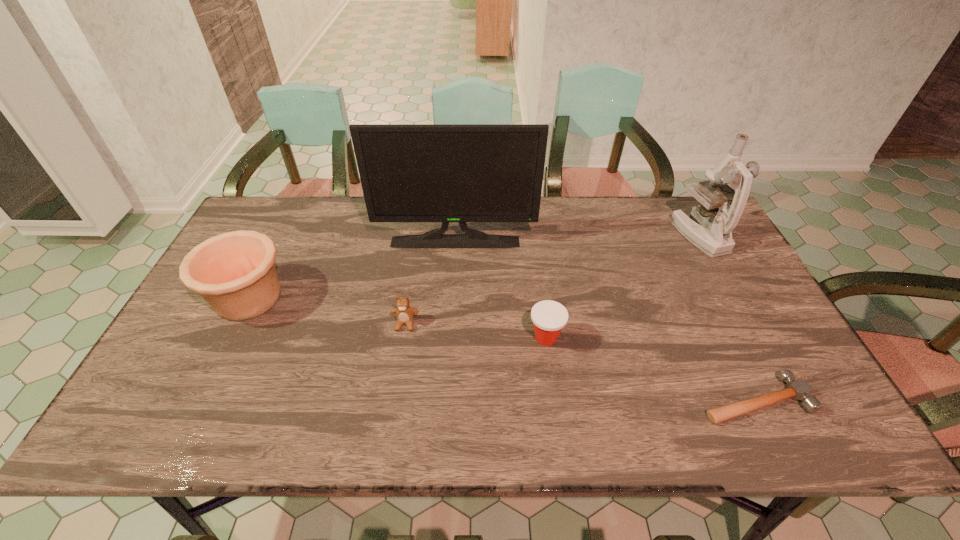
The image size is (960, 540). In order to click on free space that satisfies the following two spatial constraints: 1. on the front-facing side of the teddy bear; 2. on the right side of the Dixie cup in this screenshot , I will do `click(403, 338)`.

Locate an element on the screen. The image size is (960, 540). vacant area that satisfies the following two spatial constraints: 1. on the front-facing side of the teddy bear; 2. on the right side of the nearest object is located at coordinates (394, 399).

Find the location of a particular element. This screenshot has width=960, height=540. vacant space that satisfies the following two spatial constraints: 1. on the front-facing side of the teddy bear; 2. on the left side of the Dixie cup is located at coordinates (403, 338).

The height and width of the screenshot is (540, 960). Identify the location of free space that satisfies the following two spatial constraints: 1. on the front-facing side of the monitor; 2. on the right side of the Dixie cup. (449, 338).